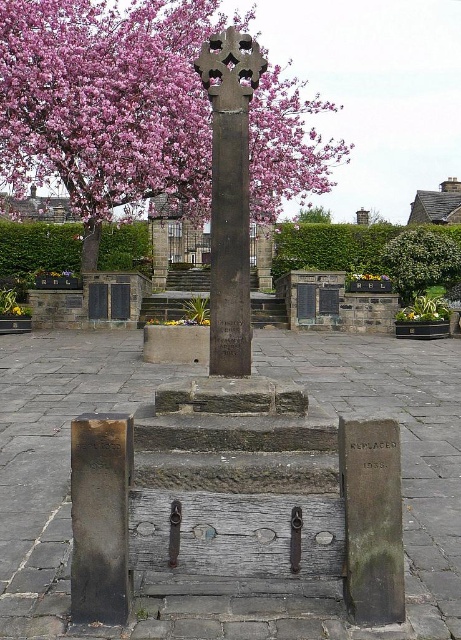
Is dark gray stone cross at center smaller than pink blossom tree at upper center?

Incorrect, dark gray stone cross at center is not smaller in size than pink blossom tree at upper center.

Is dark gray stone cross at center to the left of pink blossom tree at upper center from the viewer's perspective?

Yes, dark gray stone cross at center is to the left of pink blossom tree at upper center.

Which is in front, point (392, 476) or point (314, 218)?

Point (392, 476) is more forward.

Identify the location of dark gray stone cross at center. (234, 440).

Is dark gray stone cross at center to the right of pink blossoms at upper left from the viewer's perspective?

Correct, you'll find dark gray stone cross at center to the right of pink blossoms at upper left.

Identify the location of dark gray stone cross at center. (234, 440).

Is point (360, 586) positioned before point (25, 26)?

Yes, point (360, 586) is closer to viewer.

You are a GUI agent. You are given a task and a screenshot of the screen. Output one action in this format:
    pyautogui.click(x=<x>, y=<y>)
    Task: Click on the dark gray stone cross at center
    This screenshot has width=461, height=640.
    Given the screenshot: What is the action you would take?
    pyautogui.click(x=234, y=440)

Describe the element at coordinates (106, 100) in the screenshot. I see `pink blossoms at upper left` at that location.

Measure the distance between pink blossoms at upper left and camera.

They are 18.50 feet apart.

Locate an element on the screen. This screenshot has height=640, width=461. pink blossoms at upper left is located at coordinates (106, 100).